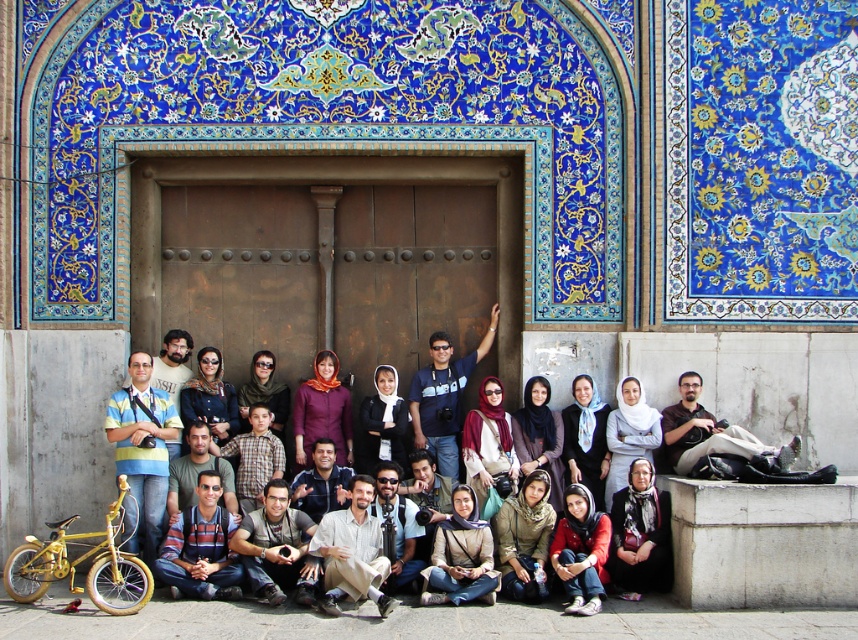
Does point (644, 557) lie behind point (559, 548)?

No, (644, 557) is closer to viewer.

Is dark gray scarf at lower center taller than matte red sweater at center?

Yes.

Where is `dark gray scarf at lower center`? dark gray scarf at lower center is located at coordinates (639, 532).

Locate an element on the screen. dark gray scarf at lower center is located at coordinates (639, 532).

Can you confirm if matte black bicycle at lower left is shorter than matte red sweater at center?

No, matte black bicycle at lower left is not shorter than matte red sweater at center.

Who is positioned more to the right, matte black bicycle at lower left or matte red sweater at center?

Positioned to the right is matte red sweater at center.

Does point (716, 348) lie in front of point (579, 586)?

No, (716, 348) is behind (579, 586).

Find the location of a particular element. matte black bicycle at lower left is located at coordinates (699, 372).

Can you confirm if matte black bicycle at lower left is positioned below dark gray scarf at lower center?

Actually, matte black bicycle at lower left is above dark gray scarf at lower center.

Is matte black bicycle at lower left taller than dark gray scarf at lower center?

Yes, matte black bicycle at lower left is taller than dark gray scarf at lower center.

The height and width of the screenshot is (640, 858). I want to click on matte black bicycle at lower left, so click(699, 372).

In order to click on matte black bicycle at lower left in this screenshot , I will do `click(699, 372)`.